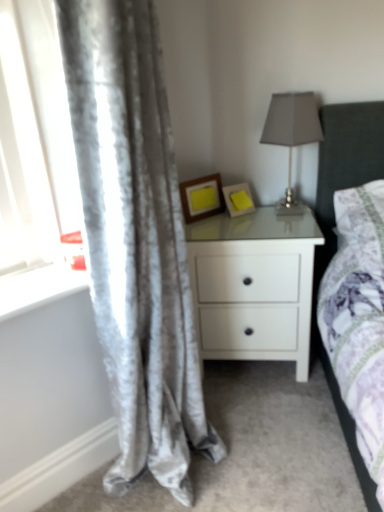
The image size is (384, 512). In order to click on empty space that is in between yellow matte picture frame at center, which is counted as the first picture frame, starting from the left, and satin gray lampshade at upper right in this screenshot , I will do `click(232, 220)`.